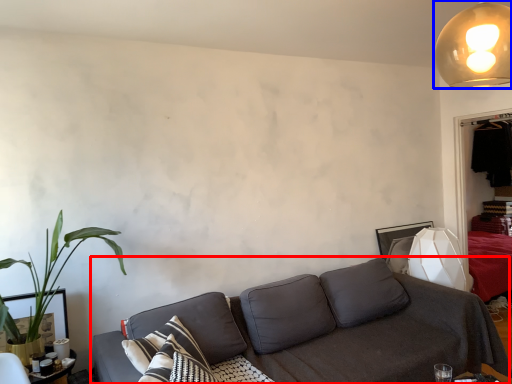
Question: Among these objects, which one is nearest to the camera, studio couch (highlighted by a red box) or lamp (highlighted by a blue box)?

Choices:
 (A) studio couch
 (B) lamp

Answer: (A)